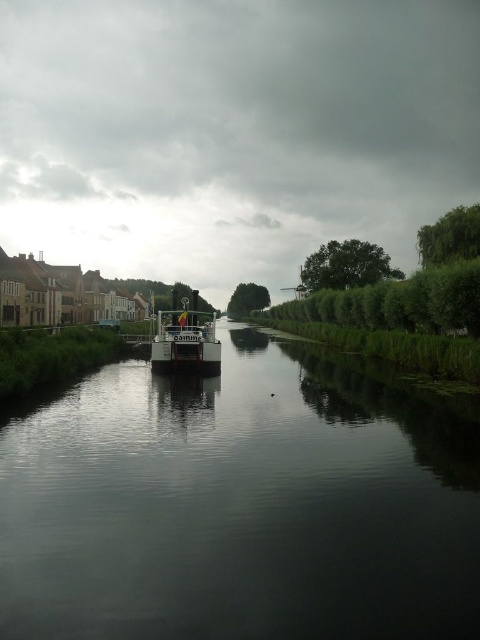
Question: Does cloudy sky at upper center have a smaller size compared to white glossy boat at center?

Choices:
 (A) yes
 (B) no

Answer: (B)

Question: Among these points, which one is farthest from the camera?

Choices:
 (A) (156, 13)
 (B) (193, 333)

Answer: (A)

Question: Observing the image, what is the correct spatial positioning of dark reflective water at center in reference to white glossy boat at center?

Choices:
 (A) below
 (B) above

Answer: (A)

Question: Among these points, which one is nearest to the camera?

Choices:
 (A) (420, 509)
 (B) (450, 12)

Answer: (A)

Question: Considering the real-world distances, which object is closest to the cloudy sky at upper center?

Choices:
 (A) white glossy boat at center
 (B) dark reflective water at center

Answer: (A)

Question: Can you confirm if dark reflective water at center is smaller than white glossy boat at center?

Choices:
 (A) no
 (B) yes

Answer: (B)